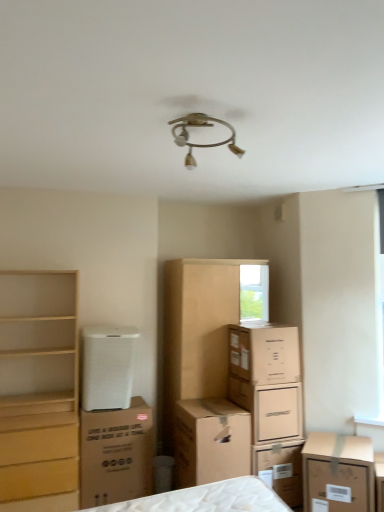
Question: Is brown cardboard dresser at center looking in the opposite direction of light wood chest of drawers at left?

Choices:
 (A) no
 (B) yes

Answer: (A)

Question: Can you confirm if brown cardboard dresser at center is shorter than light wood chest of drawers at left?

Choices:
 (A) yes
 (B) no

Answer: (B)

Question: Is the position of brown cardboard dresser at center more distant than that of light wood chest of drawers at left?

Choices:
 (A) no
 (B) yes

Answer: (B)

Question: Is brown cardboard dresser at center thinner than light wood chest of drawers at left?

Choices:
 (A) yes
 (B) no

Answer: (B)

Question: Is brown cardboard dresser at center outside of light wood chest of drawers at left?

Choices:
 (A) no
 (B) yes

Answer: (B)

Question: Looking at their shapes, would you say light wood chest of drawers at left is wider or thinner than brown cardboard box at center, which is the third cardboard box in left-to-right order?

Choices:
 (A) thin
 (B) wide

Answer: (B)

Question: Is light wood chest of drawers at left to the left or to the right of brown cardboard box at center, which is the third cardboard box in left-to-right order, in the image?

Choices:
 (A) left
 (B) right

Answer: (A)

Question: From their relative heights in the image, would you say light wood chest of drawers at left is taller or shorter than brown cardboard box at center, which is the third cardboard box in left-to-right order?

Choices:
 (A) tall
 (B) short

Answer: (A)

Question: Looking at the image, does light wood chest of drawers at left seem bigger or smaller compared to brown cardboard box at center, which is the third cardboard box in left-to-right order?

Choices:
 (A) big
 (B) small

Answer: (A)

Question: In the image, is white mesh air purifier at lower left on the left side or the right side of brown cardboard box at lower right, which is the first cardboard box from right to left?

Choices:
 (A) right
 (B) left

Answer: (B)

Question: Looking at their shapes, would you say white mesh air purifier at lower left is wider or thinner than brown cardboard box at lower right, which appears as the fifth cardboard box when viewed from the left?

Choices:
 (A) wide
 (B) thin

Answer: (B)

Question: Considering their positions, is white mesh air purifier at lower left located in front of or behind brown cardboard box at lower right, which is the first cardboard box from right to left?

Choices:
 (A) front
 (B) behind

Answer: (B)

Question: Looking at the image, does white mesh air purifier at lower left seem bigger or smaller compared to brown cardboard box at lower right, which is the first cardboard box from right to left?

Choices:
 (A) big
 (B) small

Answer: (B)

Question: Relative to brown cardboard box at center, which is the second cardboard box from left to right, is brown cardboard box at center, the 3th cardboard box positioned from the right, in front or behind?

Choices:
 (A) behind
 (B) front

Answer: (A)

Question: Is brown cardboard box at center, which is the third cardboard box in left-to-right order, bigger or smaller than brown cardboard box at center, which is the second cardboard box from left to right?

Choices:
 (A) small
 (B) big

Answer: (A)